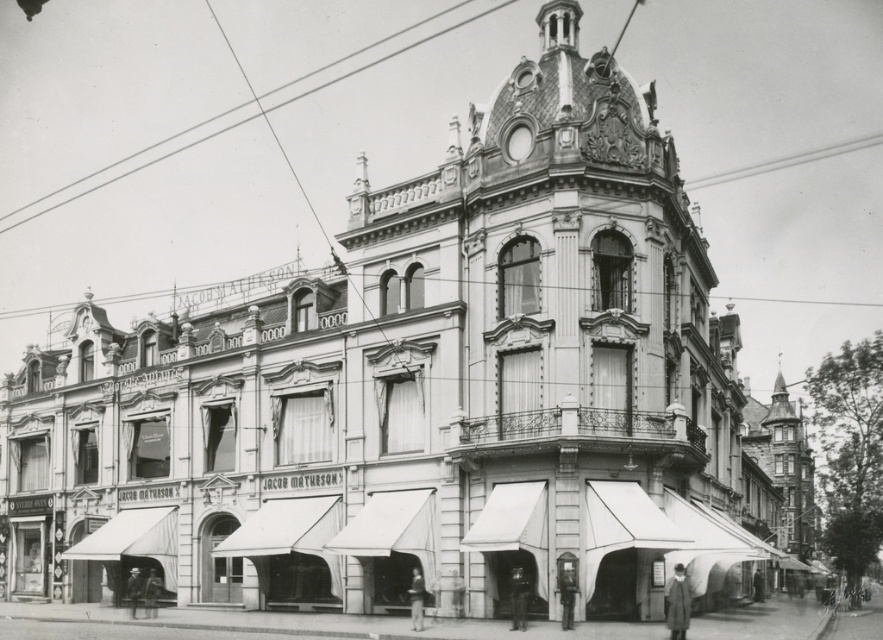
Question: Among these points, which one is farthest from the camera?

Choices:
 (A) (156, 508)
 (B) (255, 556)

Answer: (A)

Question: Does white fabric canopy at lower center have a larger size compared to white fabric canopy at lower left?

Choices:
 (A) yes
 (B) no

Answer: (B)

Question: Which point is farther to the camera?

Choices:
 (A) (73, 557)
 (B) (306, 499)

Answer: (A)

Question: Can you confirm if white fabric canopy at lower center is bigger than white fabric canopy at lower left?

Choices:
 (A) yes
 (B) no

Answer: (B)

Question: Can you confirm if white fabric canopy at lower center is positioned to the right of white fabric canopy at lower left?

Choices:
 (A) yes
 (B) no

Answer: (A)